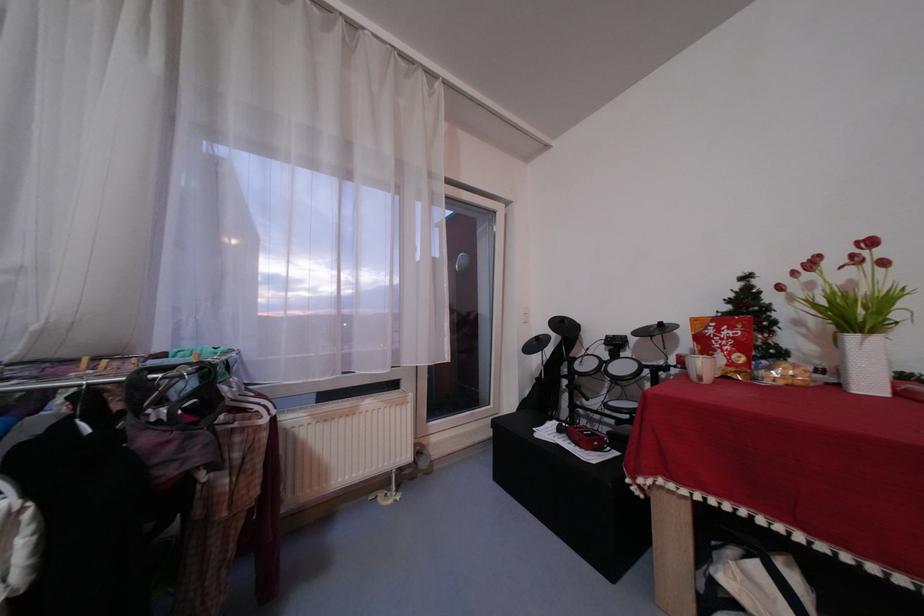
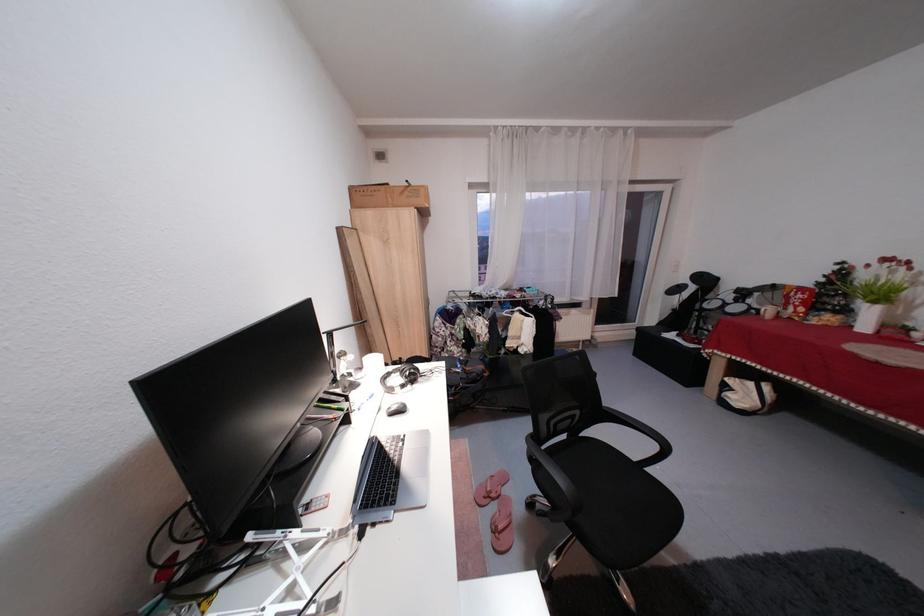
Where in the second image is the point corresponding to point (587, 360) from the first image?

(719, 302)